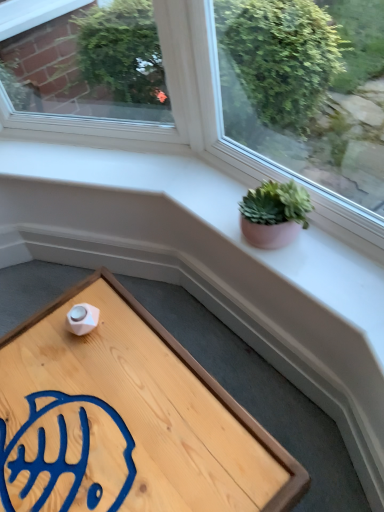
Image resolution: width=384 pixels, height=512 pixels. What do you see at coordinates (274, 213) in the screenshot? I see `green succulent in clay pot at upper right` at bounding box center [274, 213].

I want to click on green succulent in clay pot at upper right, so click(274, 213).

What is the approximate height of wooden tray at lower left?

wooden tray at lower left is 13.34 inches in height.

What do you see at coordinates (126, 420) in the screenshot? I see `wooden tray at lower left` at bounding box center [126, 420].

Where is `wooden tray at lower left`? The width and height of the screenshot is (384, 512). wooden tray at lower left is located at coordinates point(126,420).

Where is `green succulent in clay pot at upper right`? This screenshot has height=512, width=384. green succulent in clay pot at upper right is located at coordinates (274, 213).

Is green succulent in clay pot at upper right to the left or to the right of wooden tray at lower left in the image?

green succulent in clay pot at upper right is positioned on wooden tray at lower left's right side.

Considering the positions of objects green succulent in clay pot at upper right and wooden tray at lower left in the image provided, who is in front, green succulent in clay pot at upper right or wooden tray at lower left?

wooden tray at lower left is closer to the camera.

Is point (263, 239) positioned in front of point (107, 314)?

Yes, it is.

Based on the photo, from the image's perspective, which is below, green succulent in clay pot at upper right or wooden tray at lower left?

From the image's view, wooden tray at lower left is below.

From a real-world perspective, is green succulent in clay pot at upper right on wooden tray at lower left?

Yes, from a real-world perspective, green succulent in clay pot at upper right is above wooden tray at lower left.

Looking at their sizes, would you say green succulent in clay pot at upper right is wider or thinner than wooden tray at lower left?

Clearly, green succulent in clay pot at upper right has less width compared to wooden tray at lower left.

From the picture: Considering the sizes of objects green succulent in clay pot at upper right and wooden tray at lower left in the image provided, who is shorter, green succulent in clay pot at upper right or wooden tray at lower left?

Standing shorter between the two is green succulent in clay pot at upper right.

Can you confirm if green succulent in clay pot at upper right is smaller than wooden tray at lower left?

Correct, green succulent in clay pot at upper right occupies less space than wooden tray at lower left.

Does green succulent in clay pot at upper right contain wooden tray at lower left?

No.

Is green succulent in clay pot at upper right beside wooden tray at lower left?

No, green succulent in clay pot at upper right is not next to wooden tray at lower left.

Is green succulent in clay pot at upper right aimed at wooden tray at lower left?

No, green succulent in clay pot at upper right is not aimed at wooden tray at lower left.

Measure the distance between green succulent in clay pot at upper right and wooden tray at lower left.

green succulent in clay pot at upper right and wooden tray at lower left are 52.21 centimeters apart from each other.

Find the location of a particular element. The image size is (384, 512). houseplant on the right of wooden tray at lower left is located at coordinates (274, 213).

Considering the relative positions of wooden tray at lower left and green succulent in clay pot at upper right in the image provided, is wooden tray at lower left to the left of green succulent in clay pot at upper right from the viewer's perspective?

Correct, you'll find wooden tray at lower left to the left of green succulent in clay pot at upper right.

Which object is more forward, wooden tray at lower left or green succulent in clay pot at upper right?

Positioned in front is wooden tray at lower left.

Does point (151, 390) lie behind point (276, 207)?

Yes, point (151, 390) is farther from viewer.

From the image's perspective, is wooden tray at lower left on green succulent in clay pot at upper right?

Incorrect, from the image's perspective, wooden tray at lower left is lower than green succulent in clay pot at upper right.

From a real-world perspective, is wooden tray at lower left physically located above or below green succulent in clay pot at upper right?

wooden tray at lower left is situated lower than green succulent in clay pot at upper right in the real world.

Which of these two, wooden tray at lower left or green succulent in clay pot at upper right, is thinner?

green succulent in clay pot at upper right is thinner.

Is wooden tray at lower left taller than green succulent in clay pot at upper right?

Yes, wooden tray at lower left is taller than green succulent in clay pot at upper right.

Which of these two, wooden tray at lower left or green succulent in clay pot at upper right, is bigger?

wooden tray at lower left is bigger.

Choose the correct answer: Is wooden tray at lower left inside green succulent in clay pot at upper right or outside it?

wooden tray at lower left is not enclosed by green succulent in clay pot at upper right.

Are wooden tray at lower left and green succulent in clay pot at upper right beside each other?

wooden tray at lower left and green succulent in clay pot at upper right are not in contact.

Could you tell me if wooden tray at lower left is facing green succulent in clay pot at upper right?

No, wooden tray at lower left does not turn towards green succulent in clay pot at upper right.

At what (x,y) coordinates should I click in order to perform the action: click on houseplant behind the wooden tray at lower left. Please return your answer as a coordinate pair (x, y). The width and height of the screenshot is (384, 512). Looking at the image, I should click on (274, 213).

You are a GUI agent. You are given a task and a screenshot of the screen. Output one action in this format:
    pyautogui.click(x=<x>, y=<y>)
    Task: Click on the table located in front of the green succulent in clay pot at upper right
    The height and width of the screenshot is (512, 384).
    Given the screenshot: What is the action you would take?
    pyautogui.click(x=126, y=420)

You are a GUI agent. You are given a task and a screenshot of the screen. Output one action in this format:
    pyautogui.click(x=<x>, y=<y>)
    Task: Click on the houseplant on the right of wooden tray at lower left
    The height and width of the screenshot is (512, 384).
    Given the screenshot: What is the action you would take?
    pyautogui.click(x=274, y=213)